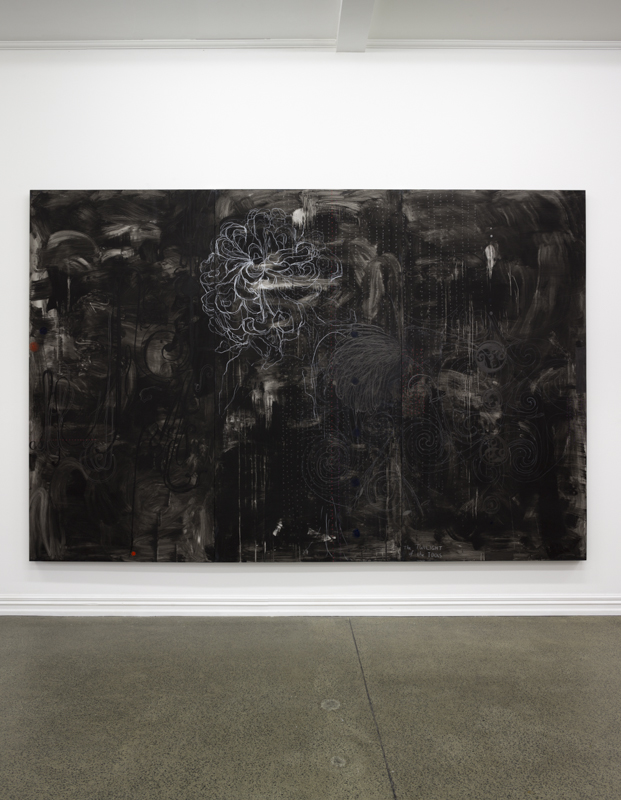
At what (x,y) coordinates should I click in order to perform the action: click on shadow on wall under the painting. Please return your answer as a coordinate pair (x, y). This screenshot has height=800, width=621. Looking at the image, I should click on (483, 672), (218, 565).